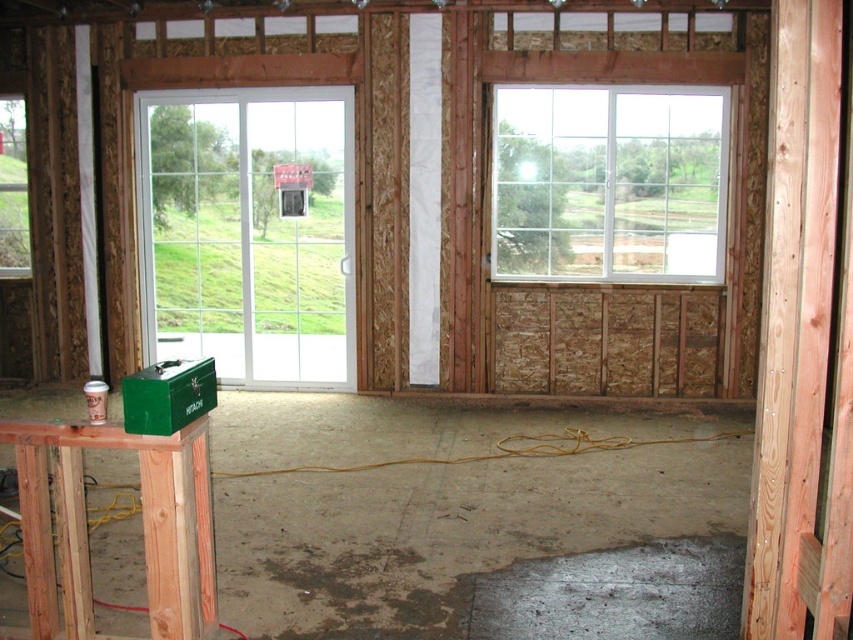
You are a contractor working in the construction site and need to exit the room. You see the white glass door at left and the white plastic window at upper right. Which one is closer to you?

The white glass door at left is closer to you because it is further to the viewer than the white plastic window at upper right, meaning it is nearer in proximity.